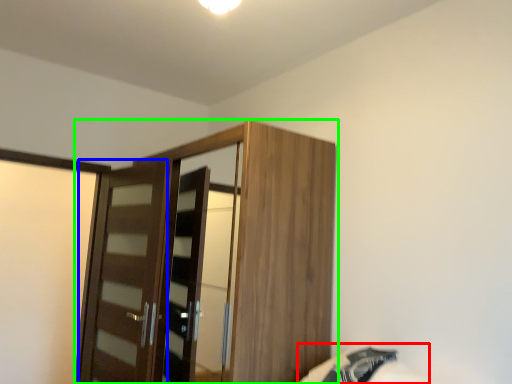
Question: Which is nearer to the bed (highlighted by a red box)? door (highlighted by a blue box) or cupboard (highlighted by a green box).

Choices:
 (A) door
 (B) cupboard

Answer: (B)